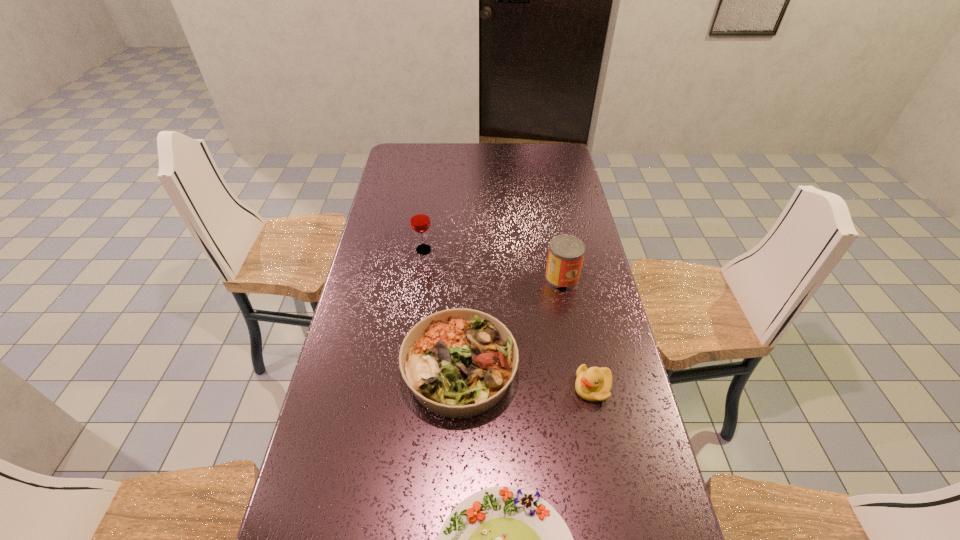
Find the location of a particular element. This screenshot has width=960, height=540. vacant space situated on the front-facing side of the duckling is located at coordinates (526, 388).

This screenshot has height=540, width=960. I want to click on free space located 0.170m on the front-facing side of the duckling, so click(x=512, y=388).

Locate an element on the screen. Image resolution: width=960 pixels, height=540 pixels. can located in the right edge section of the desktop is located at coordinates (566, 252).

You are a GUI agent. You are given a task and a screenshot of the screen. Output one action in this format:
    pyautogui.click(x=<x>, y=<y>)
    Task: Click on the duckling situated at the right edge
    This screenshot has height=540, width=960.
    Given the screenshot: What is the action you would take?
    pyautogui.click(x=593, y=384)

What are the coordinates of `vacant area at the far edge` in the screenshot? It's located at (497, 148).

In the image, there is a desktop. Identify the location of free space at the left edge. The width and height of the screenshot is (960, 540). (402, 229).

The width and height of the screenshot is (960, 540). I want to click on vacant area at the right edge, so click(x=624, y=519).

Locate an element on the screen. This screenshot has width=960, height=540. free space at the far right corner is located at coordinates (541, 151).

Identify the location of free point between the tallest object and the farther salad plate. (442, 310).

This screenshot has height=540, width=960. Find the location of `unoccupied position between the second farthest object and the farthest object`. unoccupied position between the second farthest object and the farthest object is located at coordinates (492, 264).